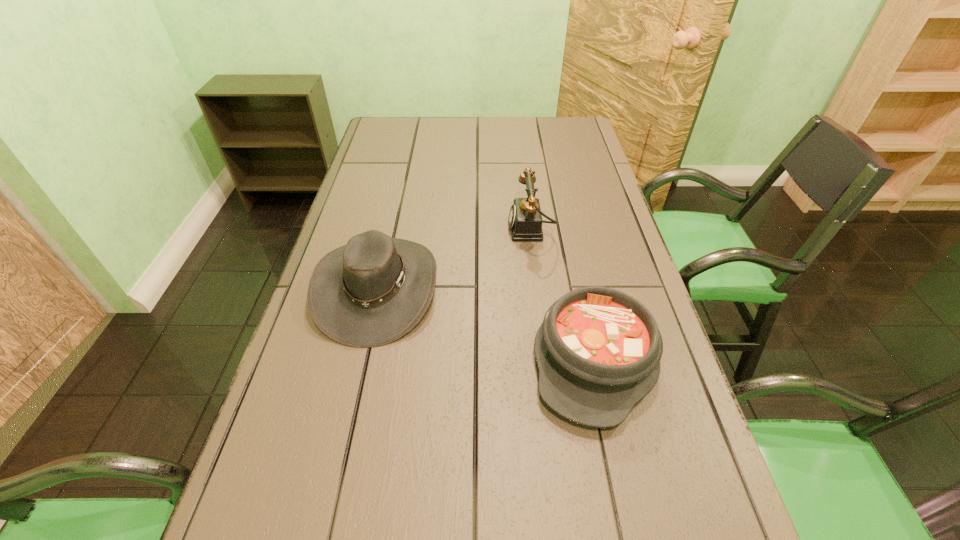
Find the location of a particular element. The width and height of the screenshot is (960, 540). unoccupied position between the rightmost white detergent and the shopping bag is located at coordinates (503, 265).

The width and height of the screenshot is (960, 540). Identify the location of object that stands as the sixth closest to the second nearest white detergent. (480, 52).

I want to click on object that stands as the second closest to the nearest object, so click(x=618, y=302).

Identify which detergent is the closest to the farthest object. Please provide its 2D coordinates. Your answer should be formatted as a tuple, i.e. [(x, y)], where the tuple contains the x and y coordinates of a point satisfying the conditions above.

[(514, 150)]

Locate which detergent is the closest to the tote bag. Please provide its 2D coordinates. Your answer should be formatted as a tuple, i.e. [(x, y)], where the tuple contains the x and y coordinates of a point satisfying the conditions above.

[(514, 150)]

Locate an element on the screen. This screenshot has width=960, height=540. white detergent that is the nearest to the farthest detergent is located at coordinates (618, 302).

Point out which white detergent is positioned as the third nearest to the left red detergent. Please provide its 2D coordinates. Your answer should be formatted as a tuple, i.e. [(x, y)], where the tuple contains the x and y coordinates of a point satisfying the conditions above.

[(514, 150)]

Point out which red detergent is positioned as the nearest to the nearest detergent. Please provide its 2D coordinates. Your answer should be formatted as a tuple, i.e. [(x, y)], where the tuple contains the x and y coordinates of a point satisfying the conditions above.

[(480, 326)]

The width and height of the screenshot is (960, 540). I want to click on red detergent that is the second closest to the tote bag, so click(275, 375).

Where is `vacant region that satisfies the following two spatial constraints: 1. on the front side of the farthest white detergent; 2. on the left side of the rightmost detergent`? The height and width of the screenshot is (540, 960). vacant region that satisfies the following two spatial constraints: 1. on the front side of the farthest white detergent; 2. on the left side of the rightmost detergent is located at coordinates (525, 331).